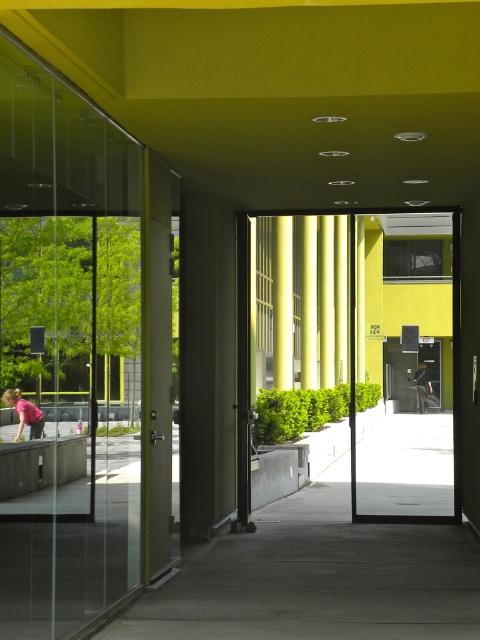
You are standing at the entrance of the corridor and want to reach the yellow matte door at center. Based on the coordinates provided, in which direction should you walk to reach it?

The yellow matte door at center is located at coordinates point (409, 368), so you should walk forward along the corridor towards the center to reach it.

You are an interior designer assessing the layout of this modern corridor. You need to place a decorative item between the yellow matte door at center and the pink fabric at lower left. Based on their positions, which object should the decorative item be placed closer to?

The decorative item should be placed closer to the yellow matte door at center since it is closer to the viewer compared to the pink fabric at lower left.